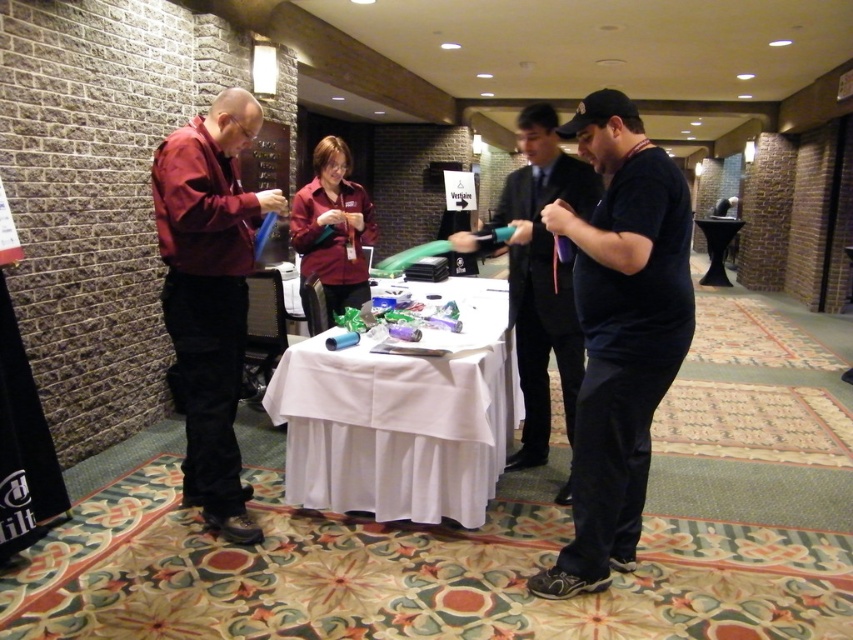
You are organizing a photo shoot and need to arrange two models wearing matte maroon shirts. The matte maroon shirt at left and the matte maroon shirt at center are available. Which model should you choose if you need someone with a wider torso for a specific pose?

The matte maroon shirt at left should be chosen because its width surpasses that of the matte maroon shirt at center, indicating a wider torso.

You are organizing a clothing donation drive and need to determine if the black matte shirt at right and the matte maroon shirt at center can fit into a donation box that has a maximum capacity of accommodating shirts up to the size of the smaller one. Based on their sizes, can both shirts fit into the box?

The black matte shirt at right is larger than the matte maroon shirt at center. Since the donation box can only hold shirts up to the size of the smaller one, the black matte shirt at right may not fit, but the matte maroon shirt at center will fit.

You are a photographer at the event and want to capture a photo where both the black matte shirt at right and the matte maroon shirt at center are visible. Based on their positions, which shirt should you focus on first to ensure both are in frame?

The black matte shirt at right is located below the matte maroon shirt at center, so focus on the matte maroon shirt at center first to ensure both are in frame.